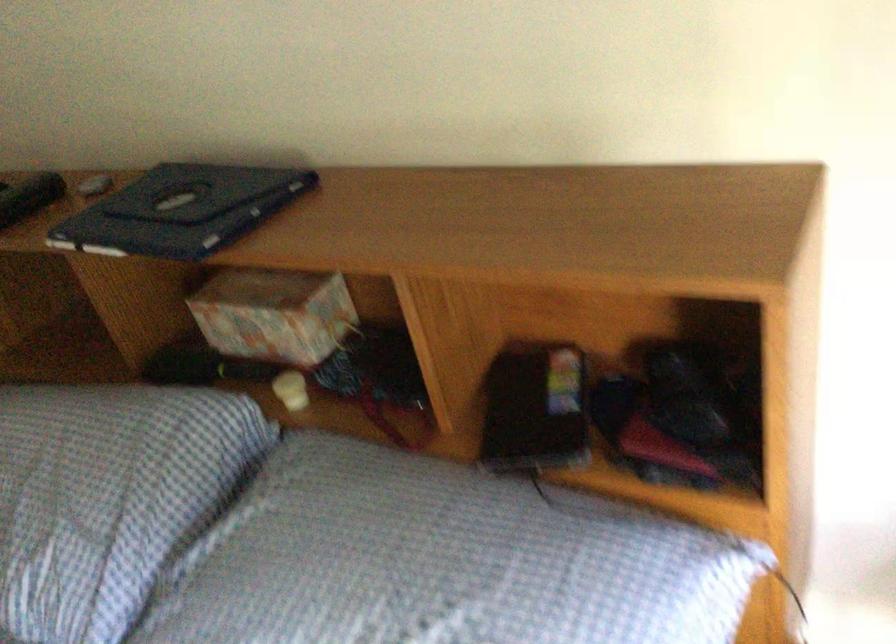
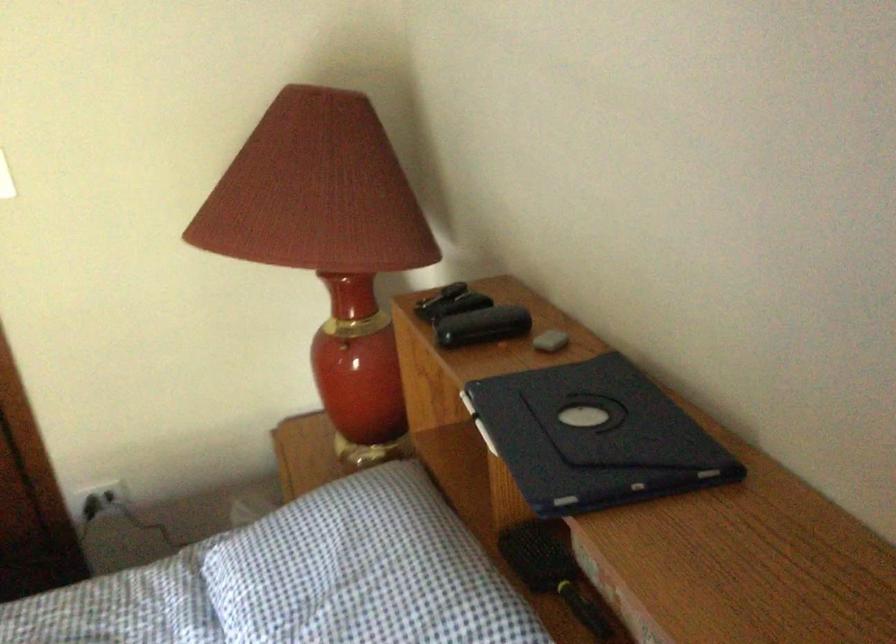
Where in the second image is the point corresponding to (196,207) from the first image?

(593, 437)